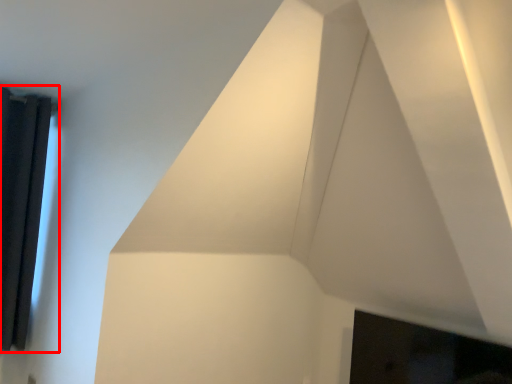
Question: Considering the relative positions of window (annotated by the red box) and fireplace in the image provided, where is window (annotated by the red box) located with respect to the staircase?

Choices:
 (A) right
 (B) left

Answer: (B)